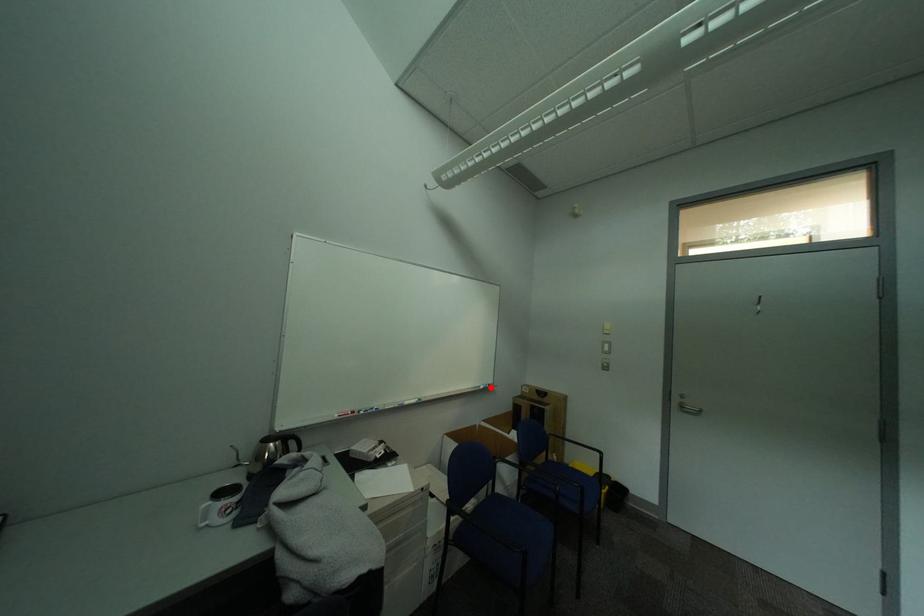
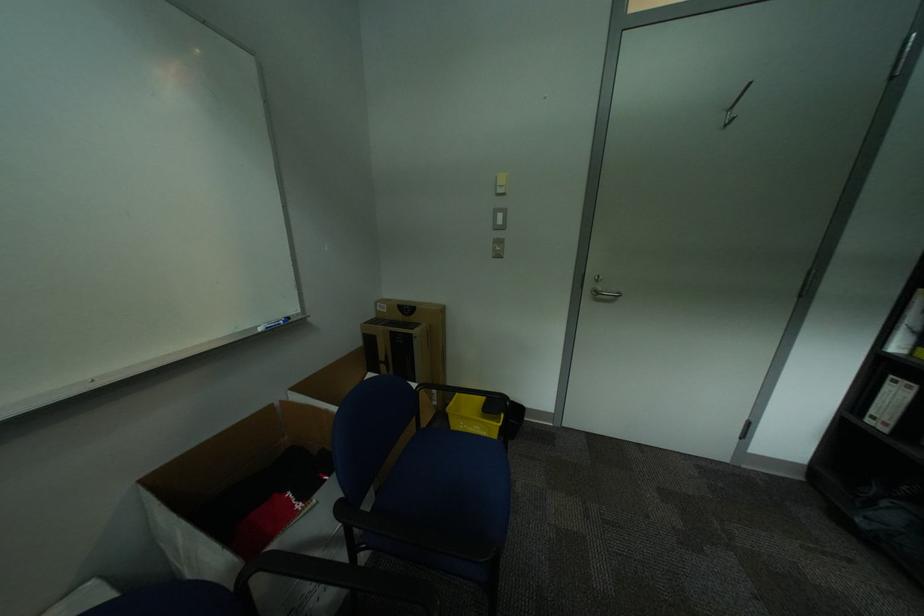
Question: I am providing you with two images of the same scene from different viewpoints. Image1 has a red point marked. In image2, the corresponding 3D location appears at what relative position? Reply with the corresponding letter.

Choices:
 (A) Closer
 (B) Farther

Answer: (A)